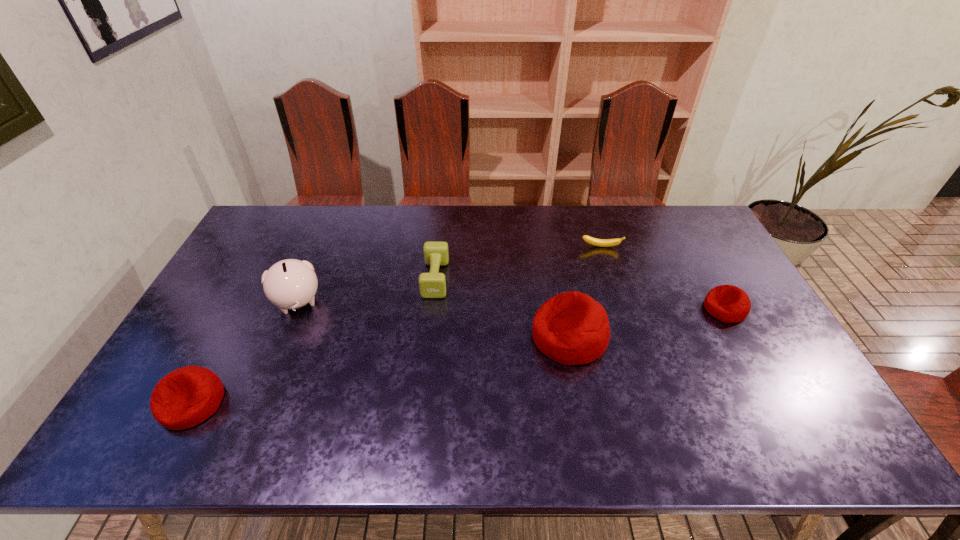
Where is `object at the near edge`? This screenshot has height=540, width=960. object at the near edge is located at coordinates (185, 397).

Where is `object present at the left edge`? This screenshot has height=540, width=960. object present at the left edge is located at coordinates (185, 397).

Locate an element on the screen. This screenshot has height=540, width=960. object that is positioned at the right edge is located at coordinates point(728,303).

At what (x,y) coordinates should I click in order to perform the action: click on object at the near left corner. Please return your answer as a coordinate pair (x, y). This screenshot has height=540, width=960. Looking at the image, I should click on (185, 397).

In the image, there is a desktop. Identify the location of free space at the far edge. Image resolution: width=960 pixels, height=540 pixels. (522, 240).

Locate an element on the screen. The width and height of the screenshot is (960, 540). free space at the near edge of the desktop is located at coordinates 664,386.

This screenshot has height=540, width=960. In order to click on vacant space at the right edge of the desktop in this screenshot , I will do `click(731, 338)`.

Locate an element on the screen. This screenshot has height=540, width=960. free space between the shortest object and the nearest beanbag is located at coordinates (396, 325).

Find the location of a particular element. free spot between the shortest beanbag and the piggy bank is located at coordinates (511, 306).

You are a GUI agent. You are given a task and a screenshot of the screen. Output one action in this format:
    pyautogui.click(x=<x>, y=<y>)
    Task: Click on the empty location between the leftmost object and the farthest object
    This screenshot has height=540, width=960.
    Given the screenshot: What is the action you would take?
    pyautogui.click(x=396, y=325)